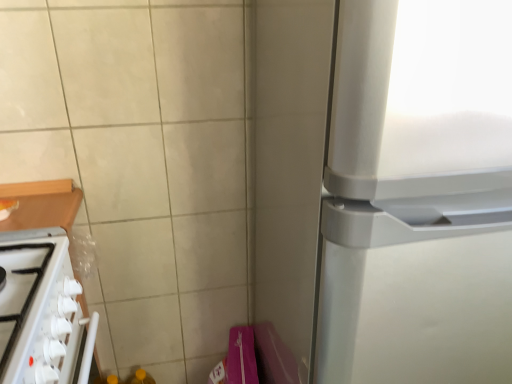
Question: Should I look upward or downward to see white glossy stove at lower left?

Choices:
 (A) up
 (B) down

Answer: (B)

Question: From a real-world perspective, is white glossy stove at lower left over satin silver refrigerator at right?

Choices:
 (A) yes
 (B) no

Answer: (B)

Question: Is white glossy stove at lower left thinner than satin silver refrigerator at right?

Choices:
 (A) no
 (B) yes

Answer: (B)

Question: Can you confirm if white glossy stove at lower left is positioned to the right of satin silver refrigerator at right?

Choices:
 (A) yes
 (B) no

Answer: (B)

Question: Is white glossy stove at lower left facing towards satin silver refrigerator at right?

Choices:
 (A) no
 (B) yes

Answer: (B)

Question: Is white glossy stove at lower left positioned with its back to satin silver refrigerator at right?

Choices:
 (A) yes
 (B) no

Answer: (B)

Question: Is white glossy stove at lower left smaller than satin silver refrigerator at right?

Choices:
 (A) yes
 (B) no

Answer: (A)

Question: Would you say satin silver refrigerator at right is a long distance from white glossy stove at lower left?

Choices:
 (A) yes
 (B) no

Answer: (B)

Question: Does satin silver refrigerator at right have a smaller size compared to white glossy stove at lower left?

Choices:
 (A) yes
 (B) no

Answer: (B)

Question: Considering the relative sizes of satin silver refrigerator at right and white glossy stove at lower left in the image provided, is satin silver refrigerator at right wider than white glossy stove at lower left?

Choices:
 (A) yes
 (B) no

Answer: (A)

Question: From the image's perspective, is satin silver refrigerator at right on top of white glossy stove at lower left?

Choices:
 (A) yes
 (B) no

Answer: (A)

Question: Is satin silver refrigerator at right to the right of white glossy stove at lower left from the viewer's perspective?

Choices:
 (A) yes
 (B) no

Answer: (A)

Question: Considering the relative sizes of satin silver refrigerator at right and white glossy stove at lower left in the image provided, is satin silver refrigerator at right taller than white glossy stove at lower left?

Choices:
 (A) no
 (B) yes

Answer: (B)

Question: Considering their positions, is white glossy stove at lower left located in front of or behind satin silver refrigerator at right?

Choices:
 (A) behind
 (B) front

Answer: (A)